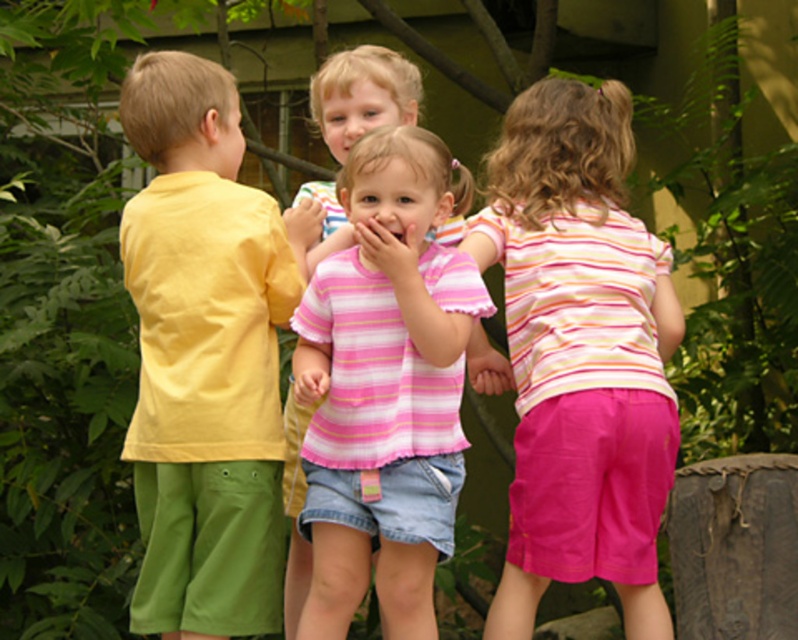
You are standing in a garden and see a child wearing a yellow cotton shirt at left. If you want to take a photo of them from where you are standing, will you need to use a zoom lens to make them appear larger in the photo?

The yellow cotton shirt at left is 4.98 meters away from the camera. Since this distance is quite far, using a zoom lens would help make the child appear larger in the photo for better clarity and focus.